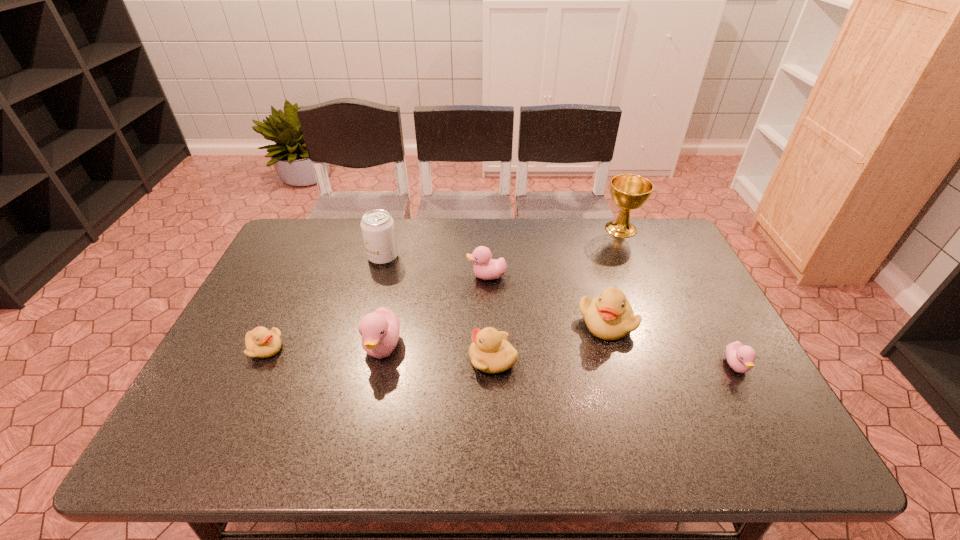
You are a GUI agent. You are given a task and a screenshot of the screen. Output one action in this format:
    pyautogui.click(x=<x>, y=<y>)
    Task: Click on the object at the far right corner
    The height and width of the screenshot is (540, 960).
    Given the screenshot: What is the action you would take?
    pyautogui.click(x=629, y=192)

You are a GUI agent. You are given a task and a screenshot of the screen. Output one action in this format:
    pyautogui.click(x=<x>, y=<y>)
    Task: Click on the free space at the far edge
    This screenshot has height=540, width=960.
    Given the screenshot: What is the action you would take?
    pyautogui.click(x=599, y=220)

Find the location of a particular element. vacant space at the near edge of the desktop is located at coordinates (395, 441).

You are a GUI agent. You are given a task and a screenshot of the screen. Output one action in this format:
    pyautogui.click(x=<x>, y=<y>)
    Task: Click on the vacant space at the right edge
    
    Given the screenshot: What is the action you would take?
    pyautogui.click(x=717, y=374)

Identify the location of free region at the near left corner of the desktop. (204, 437).

Where is `vacant space at the near right corner`? The width and height of the screenshot is (960, 540). vacant space at the near right corner is located at coordinates (780, 429).

I want to click on free spot between the second object from right to left and the rightmost object, so click(679, 298).

Find the location of `free area in between the biggest pink duckling and the second farthest object`. free area in between the biggest pink duckling and the second farthest object is located at coordinates (383, 302).

Locate an element on the screen. The image size is (960, 540). free space between the rightmost object and the biggest yellow duckling is located at coordinates (671, 344).

The height and width of the screenshot is (540, 960). I want to click on unoccupied area between the second farthest object and the second object from right to left, so click(502, 243).